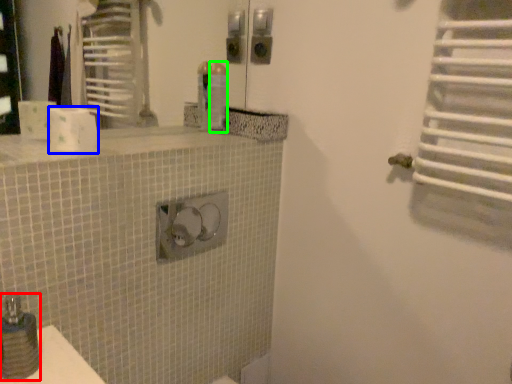
Question: Based on their relative distances, which object is farther from soap dispenser (highlighted by a red box)? Choose from toilet paper (highlighted by a blue box) and toiletry (highlighted by a green box).

Choices:
 (A) toilet paper
 (B) toiletry

Answer: (B)